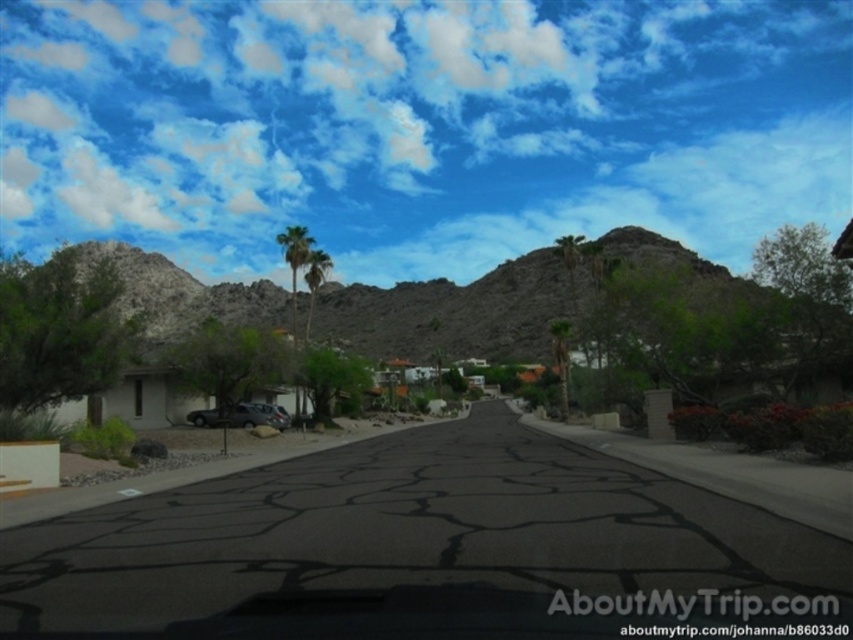
Which of these two, dark gray metallic suv at center or green leafy palm tree at center, stands shorter?

Standing shorter between the two is dark gray metallic suv at center.

Between dark gray metallic suv at center and green leafy palm tree at center, which one is positioned lower?

Positioned lower is dark gray metallic suv at center.

Identify the location of dark gray metallic suv at center. (239, 417).

Image resolution: width=853 pixels, height=640 pixels. I want to click on dark gray metallic suv at center, so click(x=239, y=417).

Based on the photo, which is more to the left, white fluffy cloud at upper center or dark gray metallic suv at center?

dark gray metallic suv at center

Who is more forward, (363, 243) or (241, 426)?

Point (241, 426)

Describe the element at coordinates (426, 124) in the screenshot. I see `white fluffy cloud at upper center` at that location.

The width and height of the screenshot is (853, 640). In order to click on white fluffy cloud at upper center in this screenshot , I will do (426, 124).

Find the location of a particular element. The height and width of the screenshot is (640, 853). rocky brown mountain at center is located at coordinates (451, 312).

Does point (560, 301) come in front of point (308, 248)?

No, (560, 301) is behind (308, 248).

Between point (523, 289) and point (293, 275), which one is positioned behind?

Positioned behind is point (523, 289).

The image size is (853, 640). Find the location of `rocky brown mountain at center`. rocky brown mountain at center is located at coordinates (451, 312).